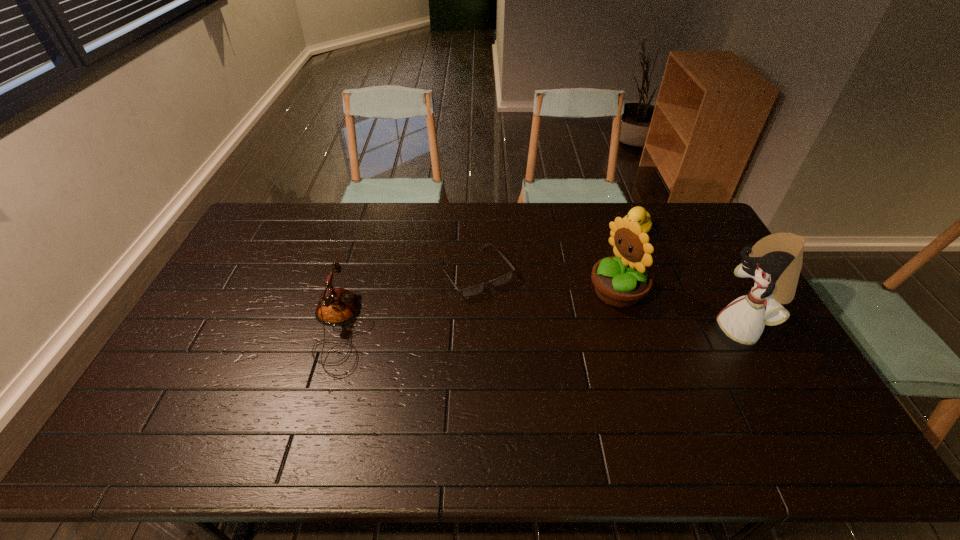
This screenshot has width=960, height=540. Identify the location of free space on the desktop that is between the leftmost object and the rightmost object and is positioned on the face of the sunflower. click(540, 329).

The width and height of the screenshot is (960, 540). What are the coordinates of `vacant spot on the desktop that is between the telephone and the doll and is positioned on the front-facing side of the spectacles` in the screenshot? It's located at (518, 329).

This screenshot has height=540, width=960. In order to click on free space on the desktop that is between the leftmost object and the rightmost object and is positioned on the beak of the farthest object in this screenshot , I will do `click(533, 329)`.